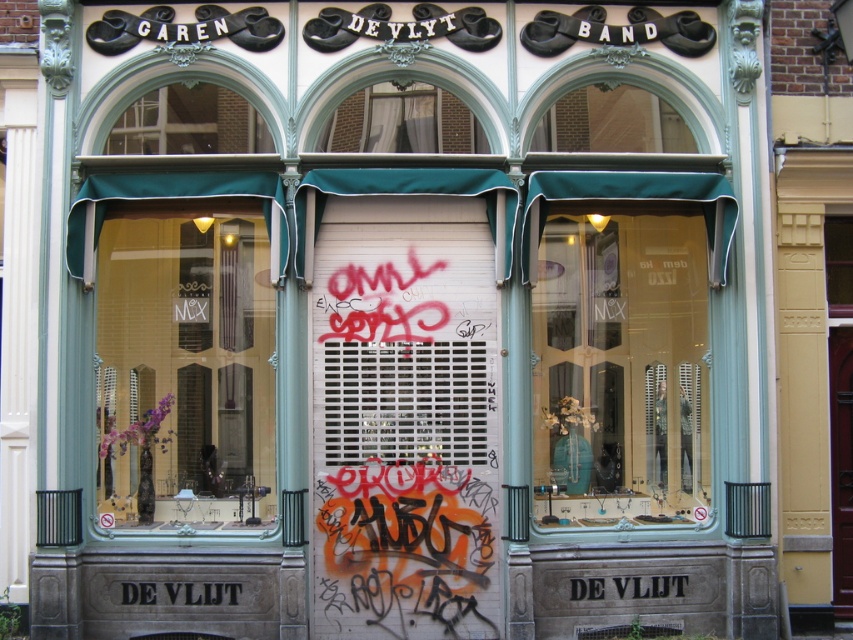
Is the position of matte glass window at center less distant than that of transparent glass window at center?

Yes.

Is matte glass window at center smaller than transparent glass window at center?

No, matte glass window at center is not smaller than transparent glass window at center.

Locate an element on the screen. matte glass window at center is located at coordinates (184, 369).

Who is positioned more to the right, matte glass jewelry display at center or transparent glass window at center?

transparent glass window at center

Who is more forward, (538, 262) or (842, 273)?

Positioned in front is point (538, 262).

Does point (624, 324) lie in front of point (840, 291)?

No, it is not.

At what (x,y) coordinates should I click in order to perform the action: click on matte glass jewelry display at center. Please return your answer as a coordinate pair (x, y). This screenshot has width=853, height=640. Looking at the image, I should click on (619, 369).

Between matte glass jewelry display at center and black wood sign at center, which one has less height?

black wood sign at center

Which is in front, point (560, 280) or point (643, 589)?

Point (643, 589) is more forward.

This screenshot has width=853, height=640. I want to click on matte glass jewelry display at center, so click(619, 369).